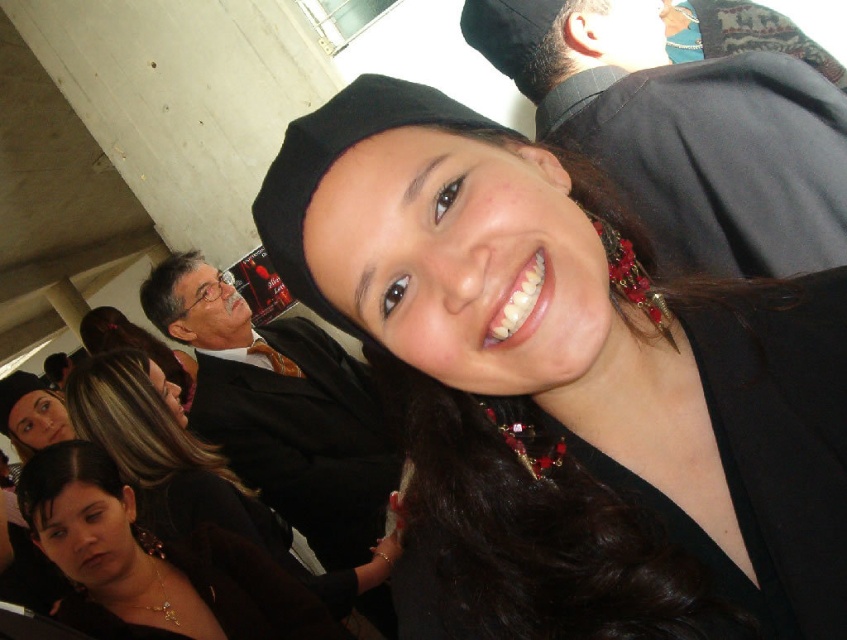
Question: Which point appears closest to the camera in this image?

Choices:
 (A) (529, 148)
 (B) (701, 72)
 (C) (297, 397)
 (D) (45, 474)

Answer: (A)

Question: Is matte black hat at center closer to the viewer compared to matte black hair at lower left?

Choices:
 (A) no
 (B) yes

Answer: (B)

Question: Which object is the farthest from the matte black hat at center?

Choices:
 (A) black suit at center
 (B) black fabric at upper right

Answer: (A)

Question: Observing the image, what is the correct spatial positioning of black suit at center in reference to matte black hair at lower left?

Choices:
 (A) above
 (B) below

Answer: (A)

Question: Which of the following is the farthest from the observer?

Choices:
 (A) black fabric at upper right
 (B) black suit at center

Answer: (B)

Question: Does matte black hat at center come behind matte black hair at lower left?

Choices:
 (A) no
 (B) yes

Answer: (A)